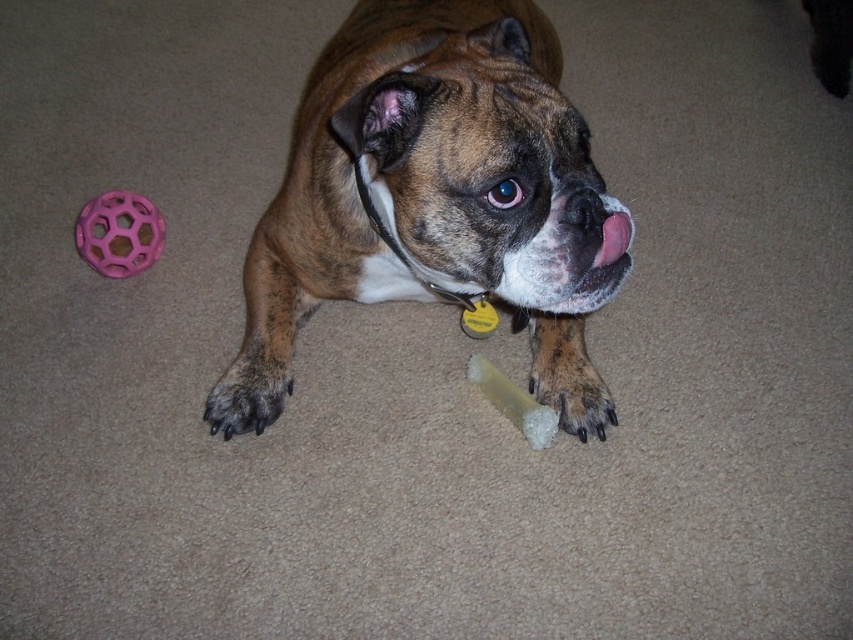
You are a dog owner who wants to fetch the pink rubber ball at upper left from the current position of the brown matte dog at center. Is the ball behind the dog or in front of the dog?

The brown matte dog at center is in front of the pink rubber ball at upper left, so the ball is behind the dog.

The scene has a brown and white dog lying on a beige carpeted floor. The dog has a collar with a yellow tag and a relaxed expression. There is a pink hexagonal ball to the left of the dog. Where is the point located at coordinates (x=432, y=198) in this scene?

The point at coordinates (x=432, y=198) is located at the brown matte dog at center.

You are a dog owner who wants to ensure your brown matte dog at center has enough space to play. The pink rubber ball at upper left is placed to the left of the dog. Based on their sizes, can the dog comfortably move around the ball without difficulty?

The brown matte dog at center is larger than the pink rubber ball at upper left, so the dog should have enough space to move around the ball comfortably.